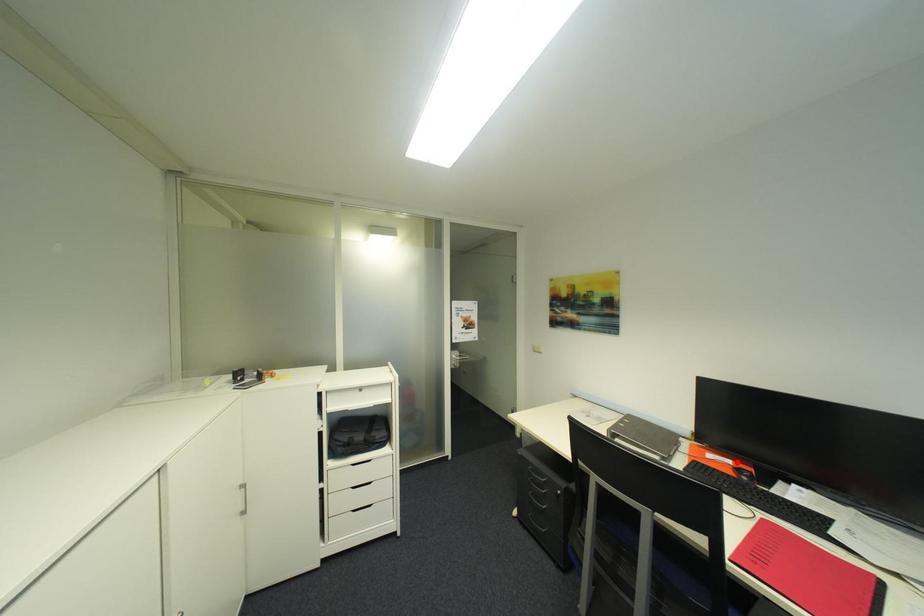
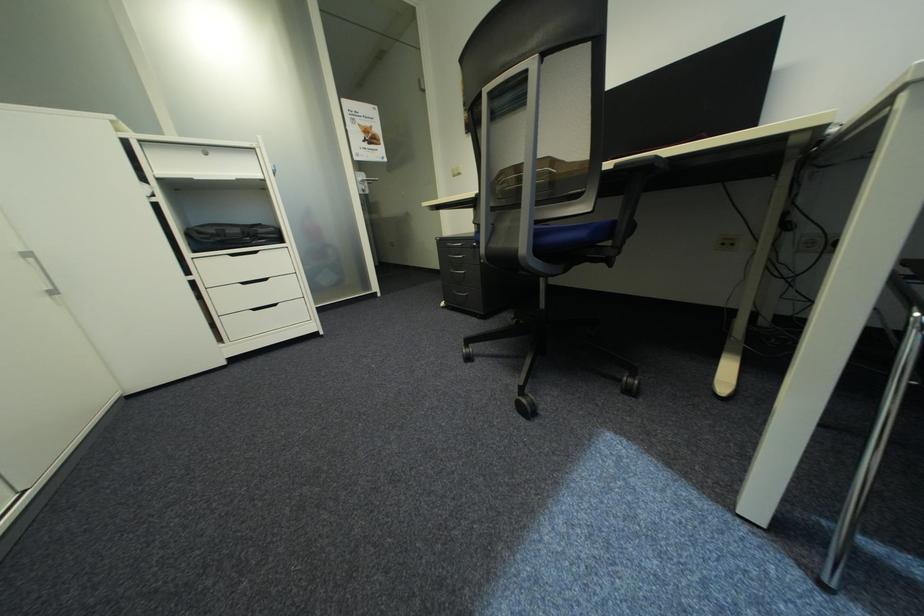
Question: I am providing you with two images of the same scene from different viewpoints. A red point is marked on the first image. Can you still see the location of the red point in image 2?

Choices:
 (A) Yes
 (B) No

Answer: (B)